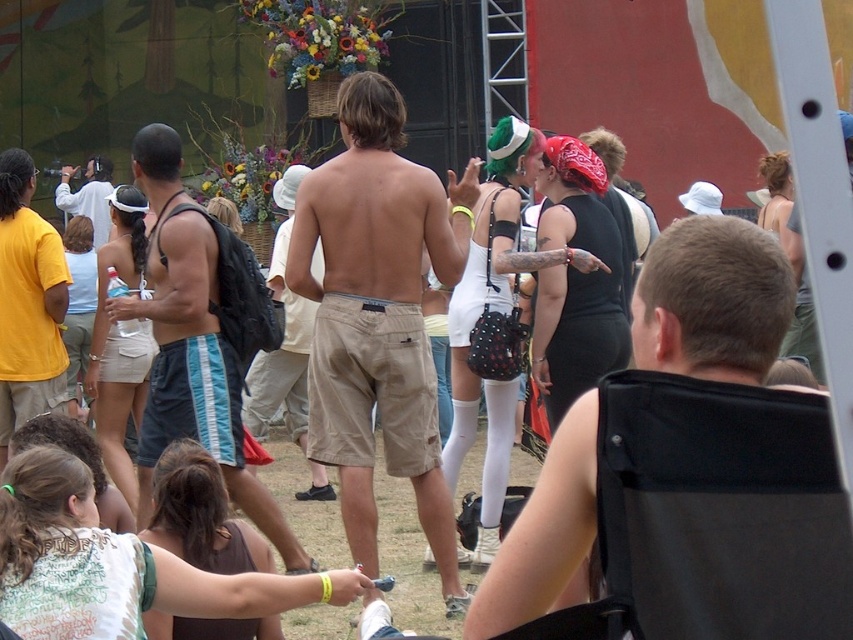
Can you confirm if light brown fabric shorts at center is smaller than yellow cotton t-shirt at left?

No.

Is light brown fabric shorts at center wider than yellow cotton t-shirt at left?

Correct, the width of light brown fabric shorts at center exceeds that of yellow cotton t-shirt at left.

Which is in front, point (527, 556) or point (0, 426)?

Point (527, 556)

The height and width of the screenshot is (640, 853). In order to click on light brown fabric shorts at center in this screenshot , I will do `click(543, 531)`.

Can you confirm if tan cotton shorts at center is positioned below yellow cotton t-shirt at left?

No, tan cotton shorts at center is not below yellow cotton t-shirt at left.

Does tan cotton shorts at center have a smaller size compared to yellow cotton t-shirt at left?

No.

Which is behind, point (315, 212) or point (16, 292)?

Point (16, 292)

The image size is (853, 640). I want to click on tan cotton shorts at center, so click(x=378, y=316).

Where is `tan cotton shorts at center`? The image size is (853, 640). tan cotton shorts at center is located at coordinates point(378,316).

Where is `tan cotton shorts at center`? This screenshot has width=853, height=640. tan cotton shorts at center is located at coordinates (378, 316).